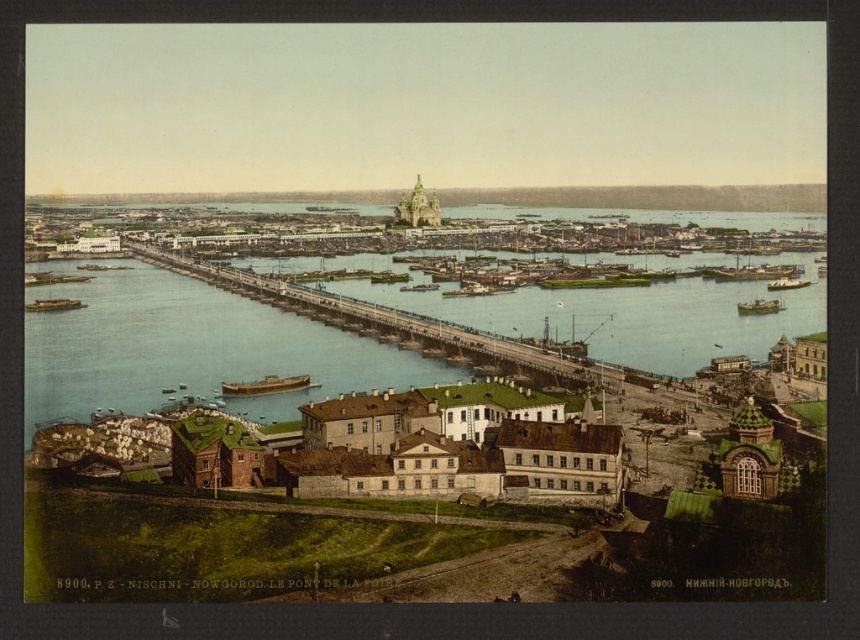
How far apart are metallic gray bridge at center and yellow wooden boat at center?

A distance of 129.49 meters exists between metallic gray bridge at center and yellow wooden boat at center.

Which is in front, point (427, 346) or point (742, 310)?

Point (427, 346) is in front.

This screenshot has height=640, width=860. Find the location of `metallic gray bridge at center`. metallic gray bridge at center is located at coordinates (394, 323).

Does wooden ship at lower left have a greater height compared to yellow wooden boat at center?

Incorrect, wooden ship at lower left's height is not larger of yellow wooden boat at center's.

Does wooden ship at lower left have a lesser width compared to yellow wooden boat at center?

Yes, wooden ship at lower left is thinner than yellow wooden boat at center.

Image resolution: width=860 pixels, height=640 pixels. Describe the element at coordinates (265, 385) in the screenshot. I see `wooden ship at lower left` at that location.

Locate an element on the screen. wooden ship at lower left is located at coordinates tap(265, 385).

Based on the photo, is blue water at center to the left of wooden ship at lower left from the viewer's perspective?

In fact, blue water at center is to the right of wooden ship at lower left.

Between blue water at center and wooden ship at lower left, which one is positioned higher?

blue water at center

Is point (123, 401) closer to camera compared to point (272, 378)?

Yes.

Where is `blue water at center`? The height and width of the screenshot is (640, 860). blue water at center is located at coordinates (185, 346).